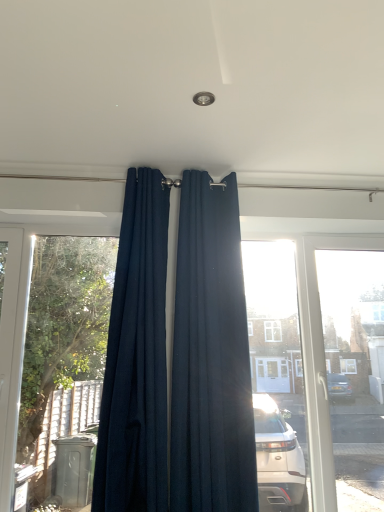
Question: From their relative heights in the image, would you say navy blue fabric curtain at center, the 1th curtain positioned from the right, is taller or shorter than navy blue fabric curtain at center, which appears as the first curtain when viewed from the left?

Choices:
 (A) short
 (B) tall

Answer: (B)

Question: From a real-world perspective, is navy blue fabric curtain at center, the second curtain positioned from the left, positioned above or below navy blue fabric curtain at center, which appears as the first curtain when viewed from the left?

Choices:
 (A) above
 (B) below

Answer: (B)

Question: In the image, is navy blue fabric curtain at center, the 1th curtain positioned from the right, on the left side or the right side of navy blue fabric curtain at center, which appears as the first curtain when viewed from the left?

Choices:
 (A) left
 (B) right

Answer: (B)

Question: From the image's perspective, is navy blue fabric curtain at center, which appears as the first curtain when viewed from the left, above or below navy blue fabric curtain at center, the second curtain positioned from the left?

Choices:
 (A) below
 (B) above

Answer: (B)

Question: Based on their sizes in the image, would you say navy blue fabric curtain at center, the 2th curtain when ordered from right to left, is bigger or smaller than navy blue fabric curtain at center, the 1th curtain positioned from the right?

Choices:
 (A) big
 (B) small

Answer: (B)

Question: Is navy blue fabric curtain at center, the 2th curtain when ordered from right to left, inside or outside of navy blue fabric curtain at center, the second curtain positioned from the left?

Choices:
 (A) outside
 (B) inside

Answer: (A)

Question: From a real-world perspective, relative to navy blue fabric curtain at center, the 1th curtain positioned from the right, is navy blue fabric curtain at center, the 2th curtain when ordered from right to left, vertically above or below?

Choices:
 (A) above
 (B) below

Answer: (A)